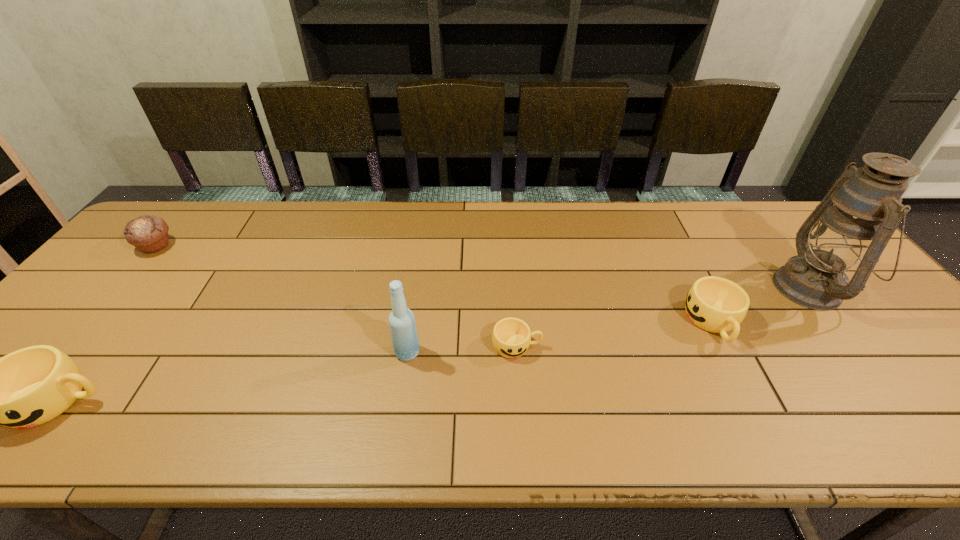
At what (x,y) coordinates should I click in order to perform the action: click on cup that stands as the closest to the nearest object. Please return your answer as a coordinate pair (x, y). Looking at the image, I should click on (511, 337).

Find the location of a particular element. vacant space that satisfies the following two spatial constraints: 1. on the back side of the shortest cup; 2. on the left side of the fifth shortest object is located at coordinates (408, 346).

Where is `vacant region that satisfies the following two spatial constraints: 1. on the back side of the second tallest object; 2. on the left side of the shortest cup`? The width and height of the screenshot is (960, 540). vacant region that satisfies the following two spatial constraints: 1. on the back side of the second tallest object; 2. on the left side of the shortest cup is located at coordinates (408, 346).